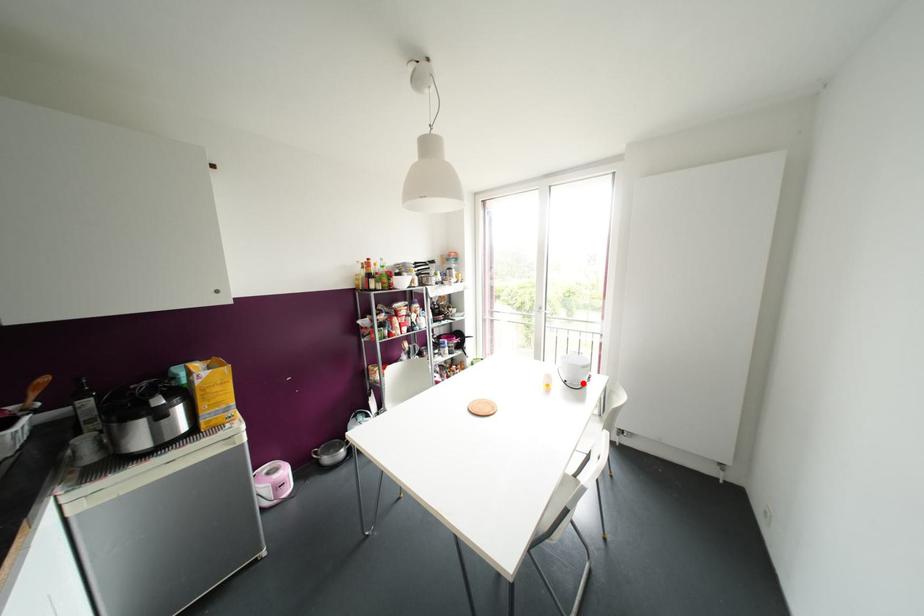
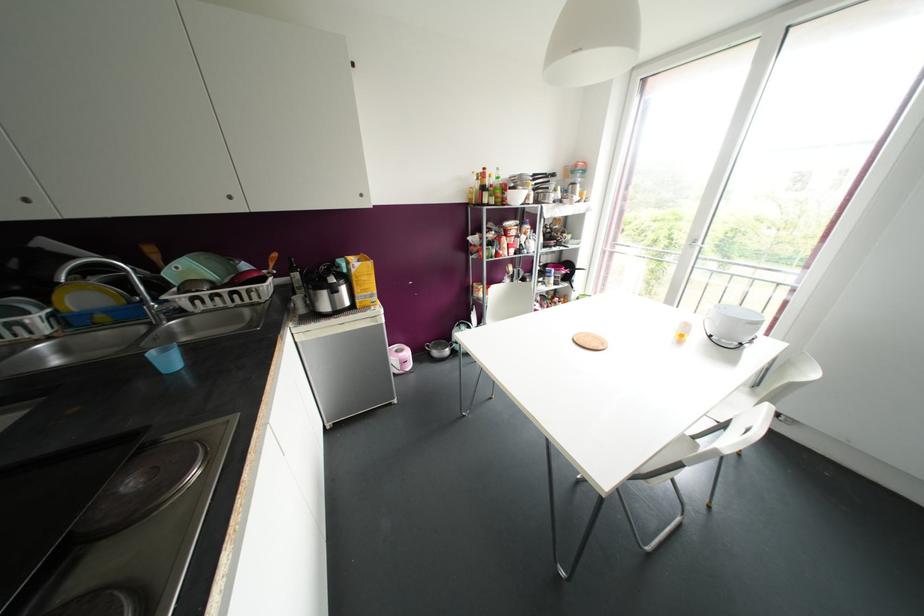
Question: A red point is marked in image1. In image2, is the corresponding 3D point closer to the camera or farther? Reply with the corresponding letter.

Choices:
 (A) The corresponding 3D point is closer.
 (B) The corresponding 3D point is farther.

Answer: (A)